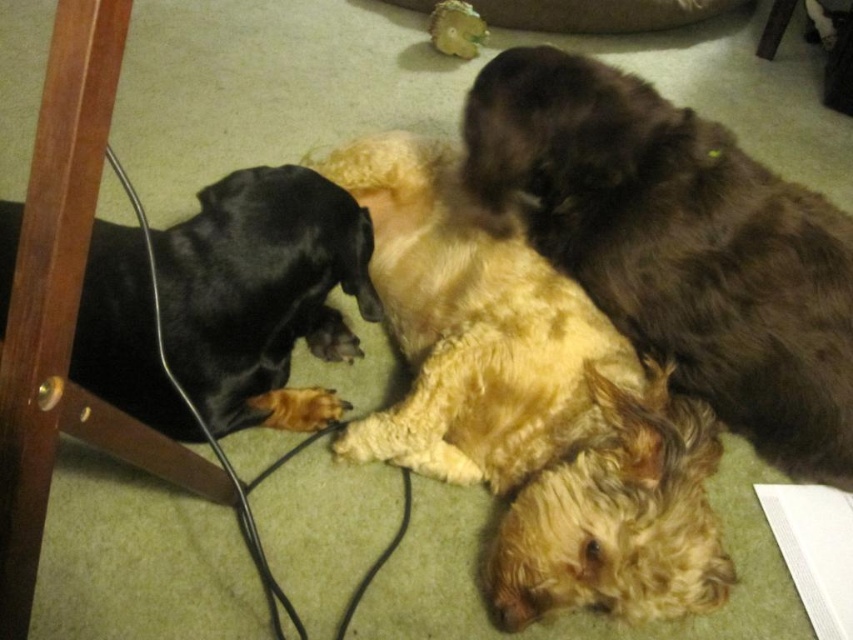
Question: Which point appears farthest from the camera in this image?

Choices:
 (A) (286, 296)
 (B) (845, 449)
 (C) (700, 404)

Answer: (B)

Question: Does fluffy golden dog at center appear under fluffy brown dog at upper right?

Choices:
 (A) yes
 (B) no

Answer: (A)

Question: Can you confirm if fluffy brown dog at upper right is positioned to the right of black smooth fur dog at left?

Choices:
 (A) yes
 (B) no

Answer: (A)

Question: Estimate the real-world distances between objects in this image. Which object is farther from the fluffy golden dog at center?

Choices:
 (A) black smooth fur dog at left
 (B) fluffy brown dog at upper right

Answer: (A)

Question: Is fluffy brown dog at upper right wider than black smooth fur dog at left?

Choices:
 (A) yes
 (B) no

Answer: (A)

Question: Which of these objects is positioned farthest from the black smooth fur dog at left?

Choices:
 (A) fluffy golden dog at center
 (B) fluffy brown dog at upper right

Answer: (B)